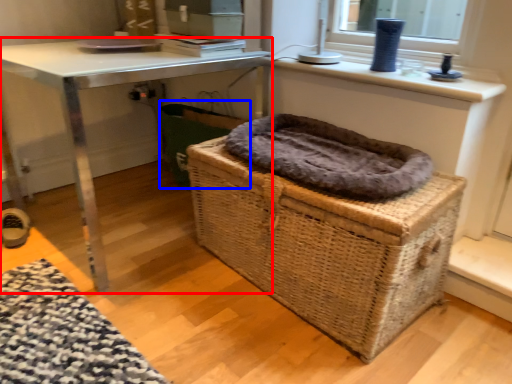
Question: Which point is closer to the camera, table (highlighted by a red box) or laundry basket (highlighted by a blue box)?

Choices:
 (A) table
 (B) laundry basket

Answer: (A)